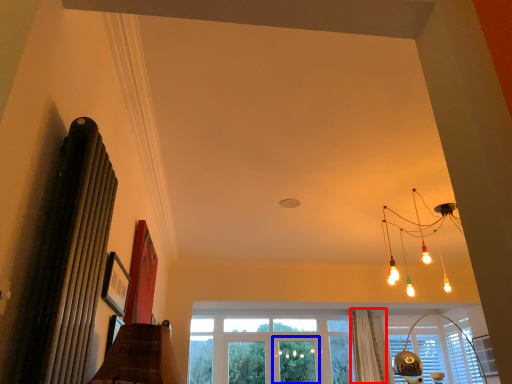
Question: Among these objects, which one is farthest to the camera, curtain (highlighted by a red box) or screen door (highlighted by a blue box)?

Choices:
 (A) curtain
 (B) screen door

Answer: (B)